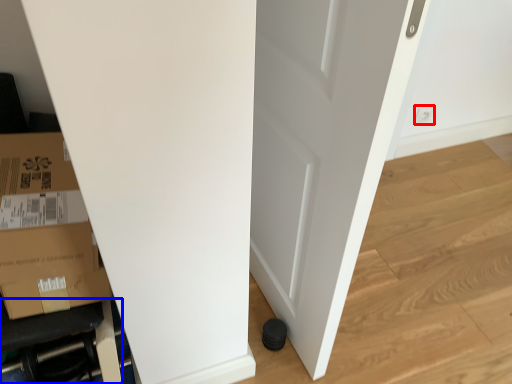
Question: Which point is further to the camera, electric outlet (highlighted by a red box) or furniture (highlighted by a blue box)?

Choices:
 (A) electric outlet
 (B) furniture

Answer: (A)